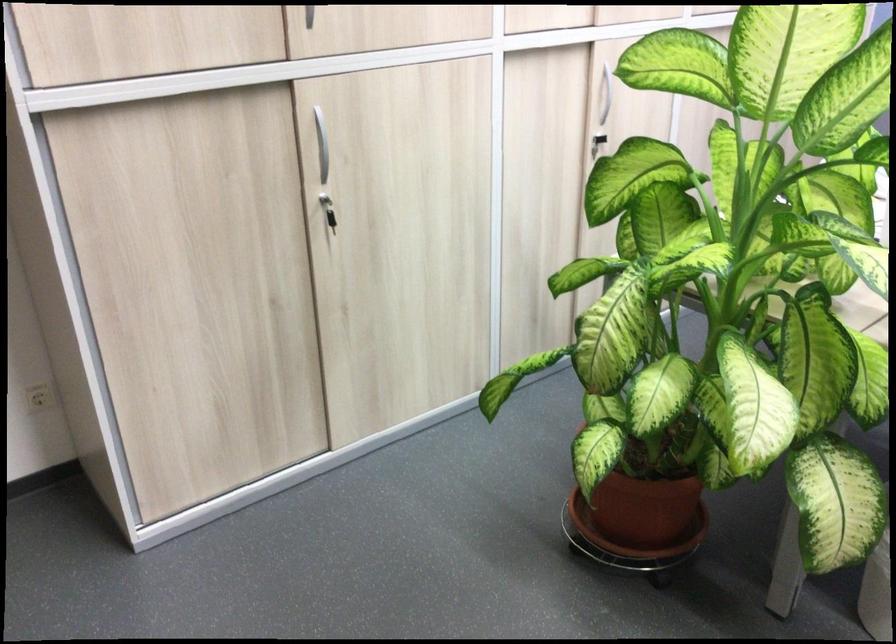
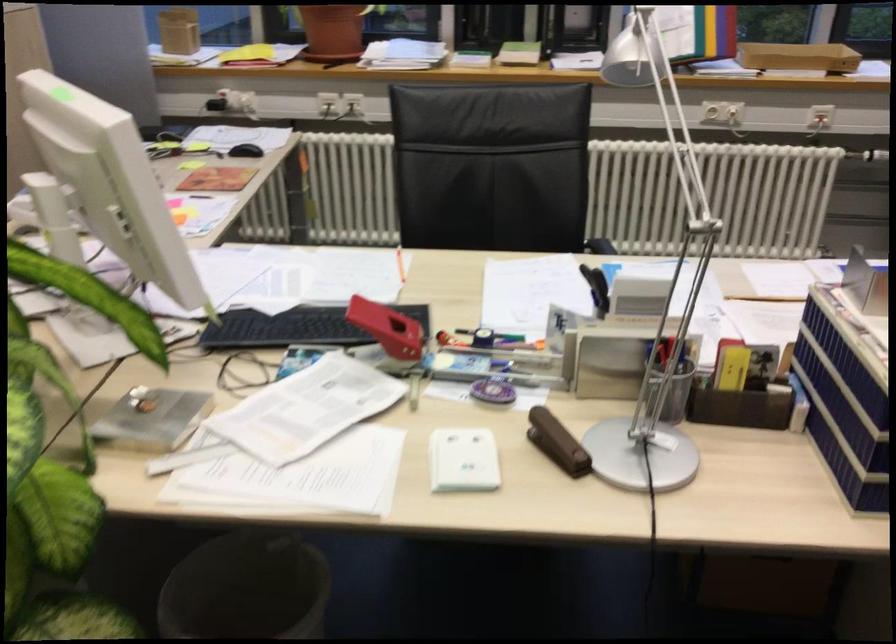
Question: Based on the continuous images, in which direction is the camera rotating? Reply with the corresponding letter.

Choices:
 (A) Left
 (B) Right
 (C) Up
 (D) Down

Answer: (B)